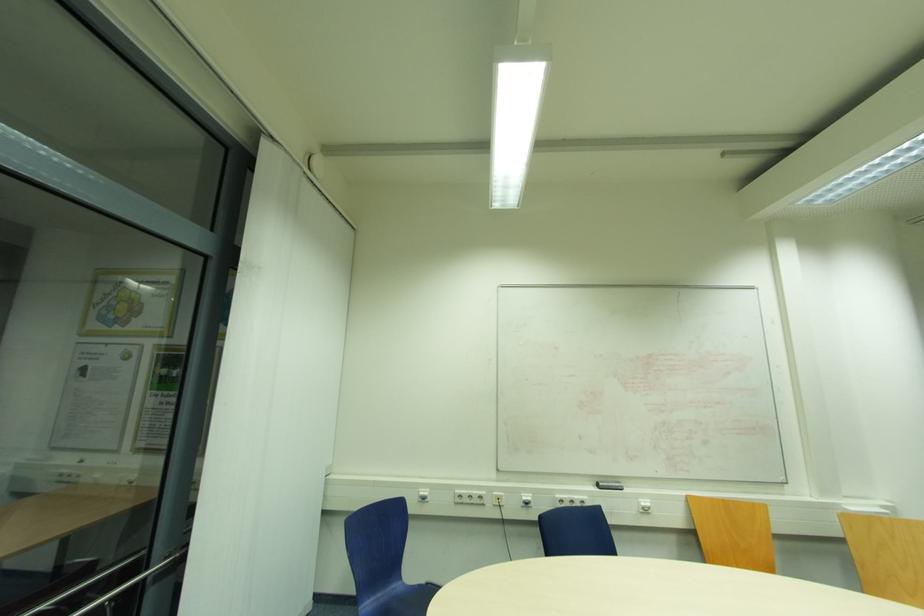
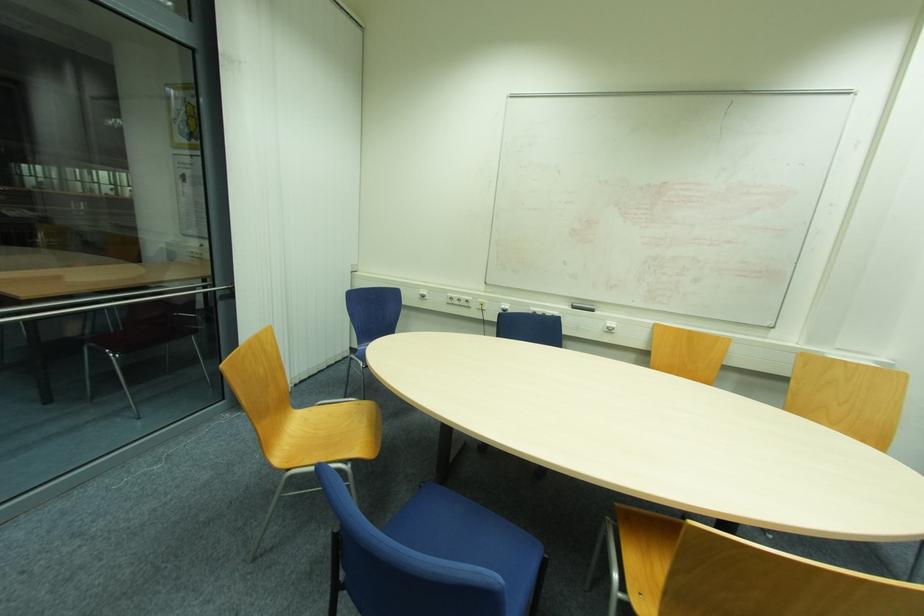
Question: In a continuous first-person perspective shot, in which direction is the camera moving?

Choices:
 (A) Left
 (B) Right
 (C) Forward
 (D) Backward

Answer: (B)